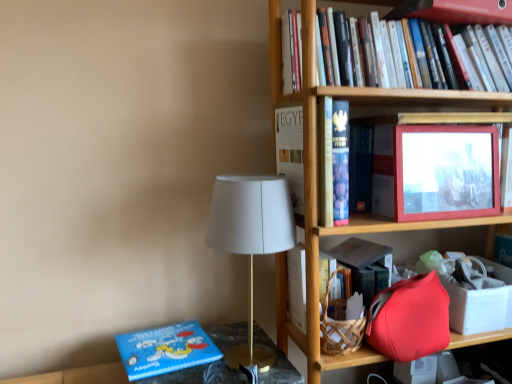
Question: Is matte red picture frame at upper right not within white matte table lamp at center?

Choices:
 (A) yes
 (B) no

Answer: (A)

Question: Can you confirm if matte red picture frame at upper right is smaller than white matte table lamp at center?

Choices:
 (A) yes
 (B) no

Answer: (A)

Question: Can you confirm if matte red picture frame at upper right is thinner than white matte table lamp at center?

Choices:
 (A) yes
 (B) no

Answer: (A)

Question: Considering the relative sizes of matte red picture frame at upper right and white matte table lamp at center in the image provided, is matte red picture frame at upper right wider than white matte table lamp at center?

Choices:
 (A) no
 (B) yes

Answer: (A)

Question: From a real-world perspective, is matte red picture frame at upper right beneath white matte table lamp at center?

Choices:
 (A) no
 (B) yes

Answer: (A)

Question: Is white matte table lamp at center a part of matte red picture frame at upper right?

Choices:
 (A) no
 (B) yes

Answer: (A)

Question: Does blue matte board book at lower left, marked as the second book in a right-to-left arrangement, have a greater width compared to hardcover book at center?

Choices:
 (A) yes
 (B) no

Answer: (A)

Question: From a real-world perspective, does blue matte board book at lower left, marked as the second book in a right-to-left arrangement, sit lower than hardcover book at center?

Choices:
 (A) no
 (B) yes

Answer: (B)

Question: Does blue matte board book at lower left, positioned as the first book in left-to-right order, have a lesser width compared to hardcover book at center?

Choices:
 (A) yes
 (B) no

Answer: (B)

Question: Is the depth of blue matte board book at lower left, marked as the second book in a right-to-left arrangement, greater than that of hardcover book at center?

Choices:
 (A) no
 (B) yes

Answer: (A)

Question: Would you say blue matte board book at lower left, positioned as the first book in left-to-right order, is outside hardcover book at center?

Choices:
 (A) no
 (B) yes

Answer: (B)

Question: Can you confirm if blue matte board book at lower left, positioned as the first book in left-to-right order, is taller than hardcover book at center?

Choices:
 (A) no
 (B) yes

Answer: (A)

Question: Is blue matte board book at lower left, marked as the second book in a right-to-left arrangement, aimed at matte red picture frame at upper right?

Choices:
 (A) yes
 (B) no

Answer: (B)